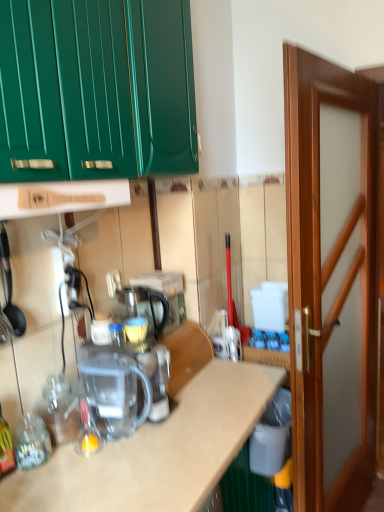
You are a GUI agent. You are given a task and a screenshot of the screen. Output one action in this format:
    pyautogui.click(x=<x>, y=<y>)
    Task: Click on the unoccupied area in front of transparent plastic bottle at lower left, the 2th bottle viewed from the front
    Image resolution: width=384 pixels, height=512 pixels.
    Given the screenshot: What is the action you would take?
    pyautogui.click(x=59, y=471)